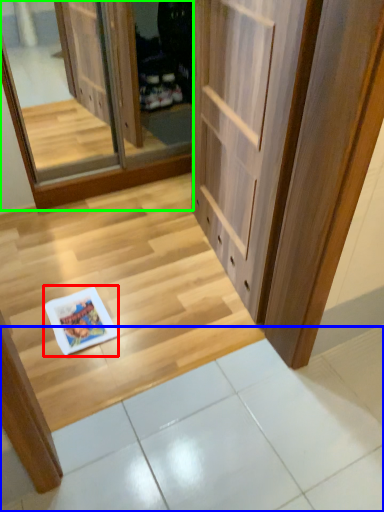
Question: Estimate the real-world distances between objects in this image. Which object is farther from magazine (highlighted by a red box), tile (highlighted by a blue box) or screen door (highlighted by a green box)?

Choices:
 (A) tile
 (B) screen door

Answer: (B)